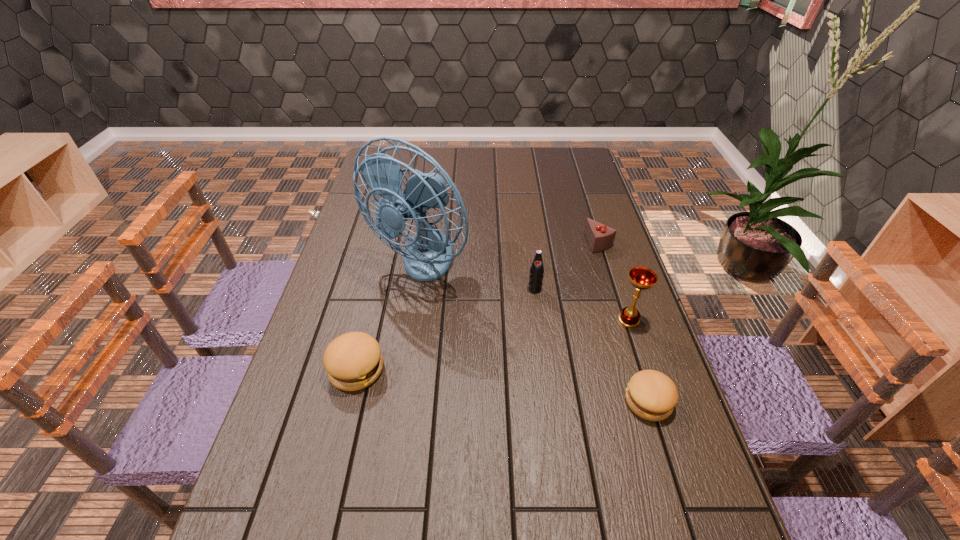
Identify the location of blank area at the right edge. The height and width of the screenshot is (540, 960). (625, 343).

At what (x,y) coordinates should I click in order to perform the action: click on vacant area at the far left corner. Please return your answer as a coordinate pair (x, y). The width and height of the screenshot is (960, 540). Looking at the image, I should click on (392, 154).

Find the location of a particular element. free region at the far right corner of the desktop is located at coordinates tap(572, 170).

Locate an element on the screen. The image size is (960, 540). empty space between the chocolate cake and the third nearest object is located at coordinates (613, 281).

Locate an element on the screen. Image resolution: width=960 pixels, height=540 pixels. free spot between the fan and the pop is located at coordinates (477, 277).

The height and width of the screenshot is (540, 960). Find the location of `blank region between the right hamburger and the taller hamburger`. blank region between the right hamburger and the taller hamburger is located at coordinates (502, 386).

The height and width of the screenshot is (540, 960). Find the location of `vacant area between the taller hamburger and the fourth object from right to left`. vacant area between the taller hamburger and the fourth object from right to left is located at coordinates (445, 329).

Where is `empty location between the taller hamburger and the third nearest object`? This screenshot has width=960, height=540. empty location between the taller hamburger and the third nearest object is located at coordinates click(492, 345).

Identify the location of empty space between the chalice and the fourth shortest object. The width and height of the screenshot is (960, 540). (582, 305).

Where is `vacant space in between the chocolate cake and the fourth farthest object`? The image size is (960, 540). vacant space in between the chocolate cake and the fourth farthest object is located at coordinates (613, 281).